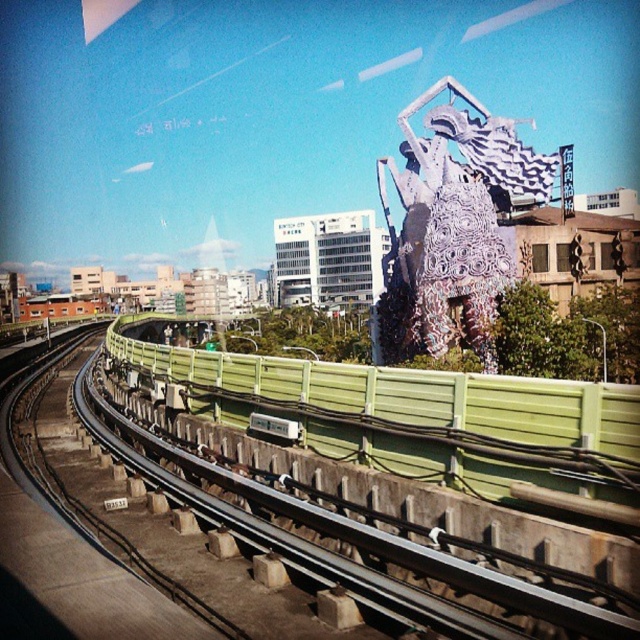
In the scene shown: Which is below, green concrete rail at center or white metallic sculpture at upper right?

green concrete rail at center is below.

Does point (406, 413) come in front of point (452, 285)?

Yes, it is in front of point (452, 285).

Find the location of `green concrete rail at center`. green concrete rail at center is located at coordinates (300, 499).